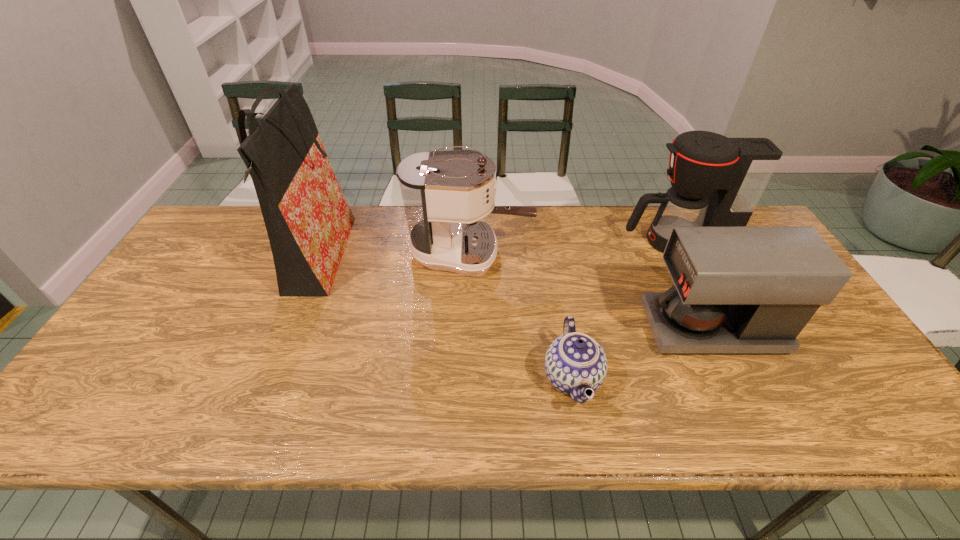
This screenshot has width=960, height=540. What are the coordinates of `free space located 0.200m on the carafe side of the second shortest object` in the screenshot? It's located at (571, 328).

Find the location of a particular element. This screenshot has width=960, height=540. vacant position located 0.230m at the spout of the chinaware is located at coordinates (444, 378).

In order to click on vacant space located 0.060m at the spout of the chinaware in this screenshot , I will do `click(517, 378)`.

Where is `free space located at the spout of the chinaware`? free space located at the spout of the chinaware is located at coordinates click(x=441, y=378).

Locate an element on the screen. shopping bag that is at the far edge is located at coordinates (308, 221).

Locate an element on the screen. object positioned at the near edge is located at coordinates (574, 362).

You are a GUI agent. You are given a task and a screenshot of the screen. Output one action in this format:
    pyautogui.click(x=<x>, y=<y>)
    Task: Click on the object situated at the far right corner
    This screenshot has width=960, height=540.
    Given the screenshot: What is the action you would take?
    pyautogui.click(x=716, y=181)

The image size is (960, 540). I want to click on vacant space at the far edge of the desktop, so click(536, 219).

This screenshot has height=540, width=960. In the image, there is a desktop. Identify the location of free space at the near edge. (168, 410).

In order to click on vacant space at the left edge of the desktop in this screenshot , I will do `click(99, 394)`.